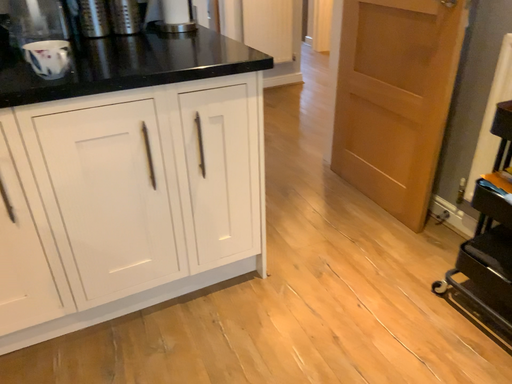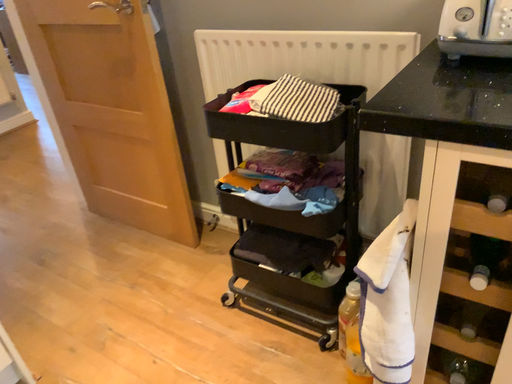
Question: Which way did the camera rotate in the video?

Choices:
 (A) rotated upward
 (B) rotated downward

Answer: (A)